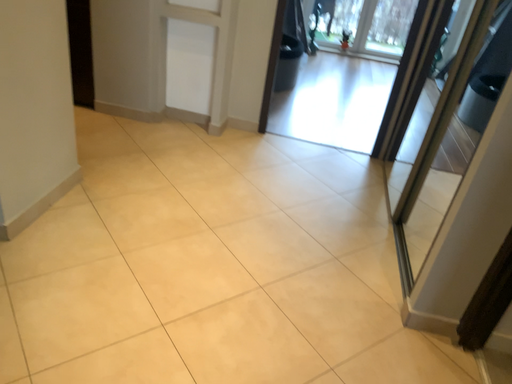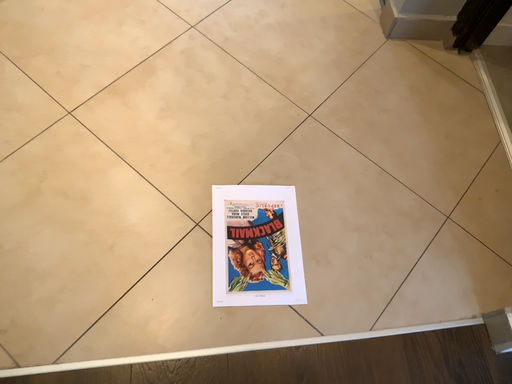
Question: How did the camera likely rotate when shooting the video?

Choices:
 (A) rotated right
 (B) rotated left

Answer: (A)